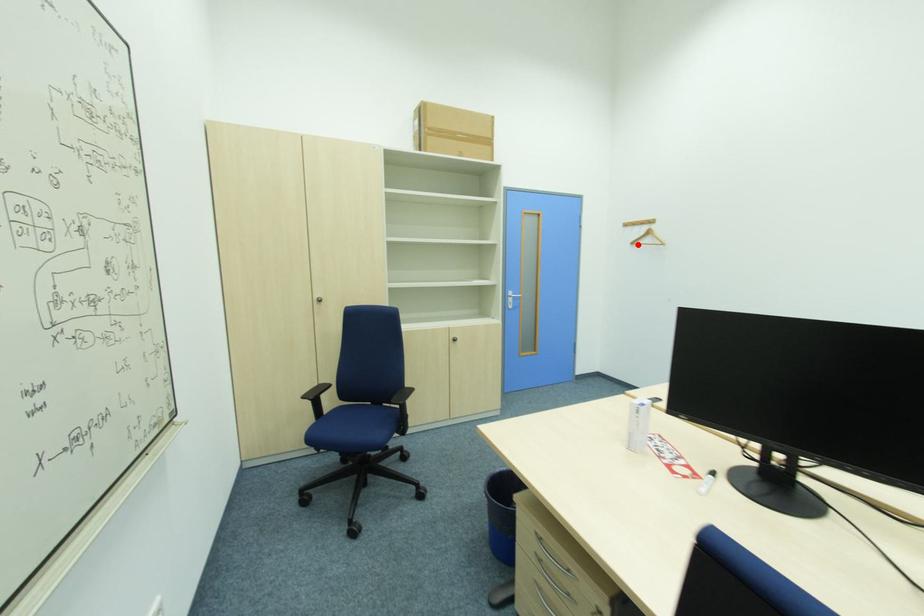
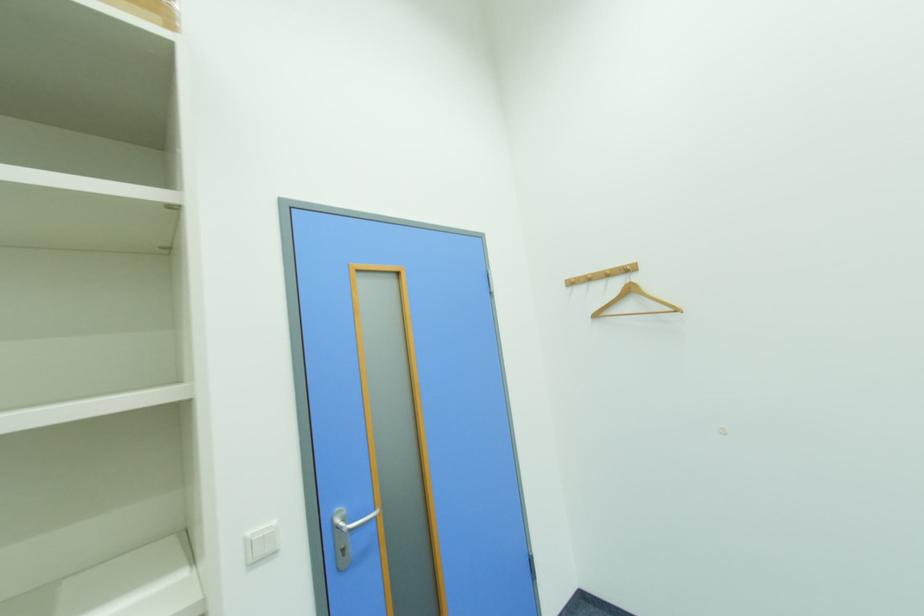
Where in the second image is the point corresponding to the highlighted location from the first image?

(601, 317)